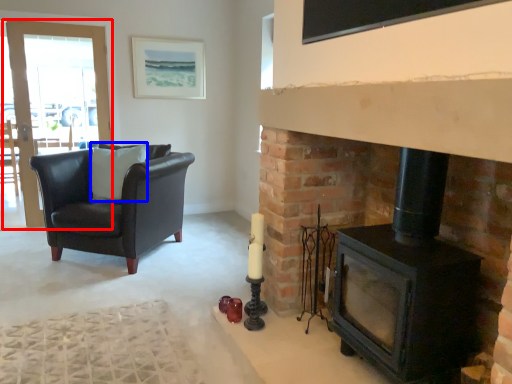
Question: Which object appears farthest to the camera in this image, screen door (highlighted by a red box) or pillow (highlighted by a blue box)?

Choices:
 (A) screen door
 (B) pillow

Answer: (A)